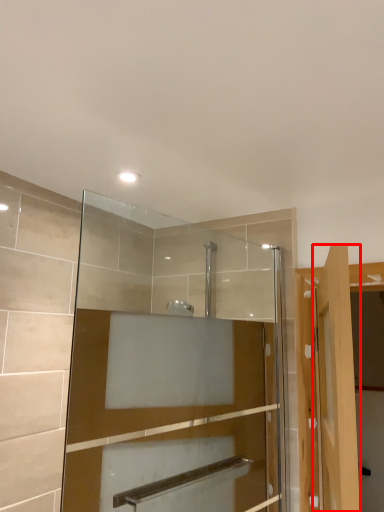
Question: From the image's perspective, where is door (annotated by the red box) located in relation to mirror in the image?

Choices:
 (A) below
 (B) above

Answer: (A)